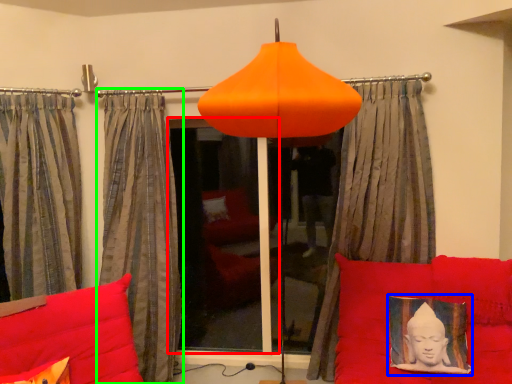
Question: Considering the real-world distances, which object is farthest from window screen (highlighted by a red box)? picture frame (highlighted by a blue box) or curtain (highlighted by a green box)?

Choices:
 (A) picture frame
 (B) curtain

Answer: (A)